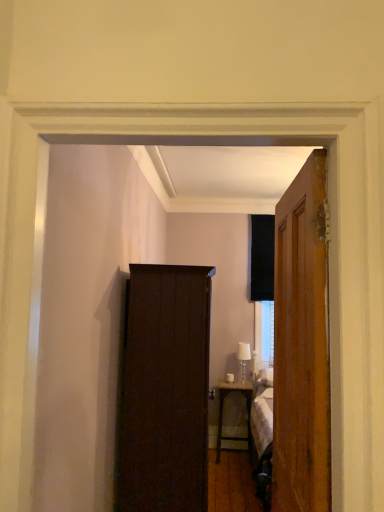
Question: From a real-world perspective, is wooden door at right over metallic silver desk at center?

Choices:
 (A) no
 (B) yes

Answer: (B)

Question: Is the depth of wooden door at right less than that of metallic silver desk at center?

Choices:
 (A) yes
 (B) no

Answer: (A)

Question: Is wooden door at right bigger than metallic silver desk at center?

Choices:
 (A) yes
 (B) no

Answer: (A)

Question: Could you tell me if wooden door at right is turned towards metallic silver desk at center?

Choices:
 (A) yes
 (B) no

Answer: (B)

Question: Is wooden door at right at the left side of metallic silver desk at center?

Choices:
 (A) no
 (B) yes

Answer: (B)

Question: Is wooden door at right facing away from metallic silver desk at center?

Choices:
 (A) no
 (B) yes

Answer: (A)

Question: Can you confirm if wooden door at right is wider than dark wood cabinet at center?

Choices:
 (A) no
 (B) yes

Answer: (A)

Question: Does wooden door at right have a lesser width compared to dark wood cabinet at center?

Choices:
 (A) yes
 (B) no

Answer: (A)

Question: From the image's perspective, would you say wooden door at right is positioned over dark wood cabinet at center?

Choices:
 (A) no
 (B) yes

Answer: (B)

Question: Is wooden door at right taller than dark wood cabinet at center?

Choices:
 (A) no
 (B) yes

Answer: (A)

Question: Is wooden door at right completely or partially outside of dark wood cabinet at center?

Choices:
 (A) yes
 (B) no

Answer: (A)

Question: Is there a large distance between wooden door at right and dark wood cabinet at center?

Choices:
 (A) no
 (B) yes

Answer: (B)

Question: Is dark wood cabinet at center to the left of metallic silver desk at center from the viewer's perspective?

Choices:
 (A) no
 (B) yes

Answer: (B)